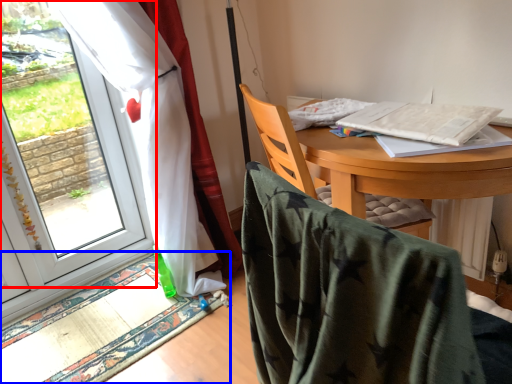
Question: Which object appears closest to the camera in this image, window (highlighted by a red box) or mat (highlighted by a blue box)?

Choices:
 (A) window
 (B) mat

Answer: (B)